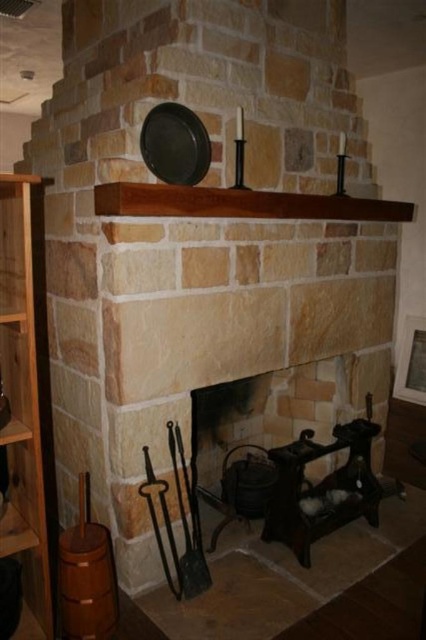
You are a painter standing in front of the fireplace. You need to hang a picture frame that is 1.5 meters tall on the wall. Can you hang it above the dark brown wood fireplace at center without it overlapping the black metal shovel at lower center?

The dark brown wood fireplace at center is much taller than the black metal shovel at lower center. Since the fireplace is taller, there is sufficient vertical space above it to hang a 1.5 meter tall picture frame without overlapping the shovel, which is positioned lower.

You are an interior designer planning to move the brown wooden bookshelf at left closer to the black metal shovel at lower center. Based on their widths, will the bookshelf fit in the space currently occupied by the shovel?

The brown wooden bookshelf at left might be wider than the black metal shovel at lower center, so there is a possibility that the bookshelf will not fit in the space currently occupied by the shovel. It is recommended to measure the exact dimensions before moving.

You are an interior designer planning to place a large painting between the dark brown wood fireplace at center and the brown wooden bookshelf at left. Given their sizes, which object should the painting be closer to, and why?

The painting should be closer to the dark brown wood fireplace at center because it has a larger size compared to the brown wooden bookshelf at left, making it a more prominent focal point.